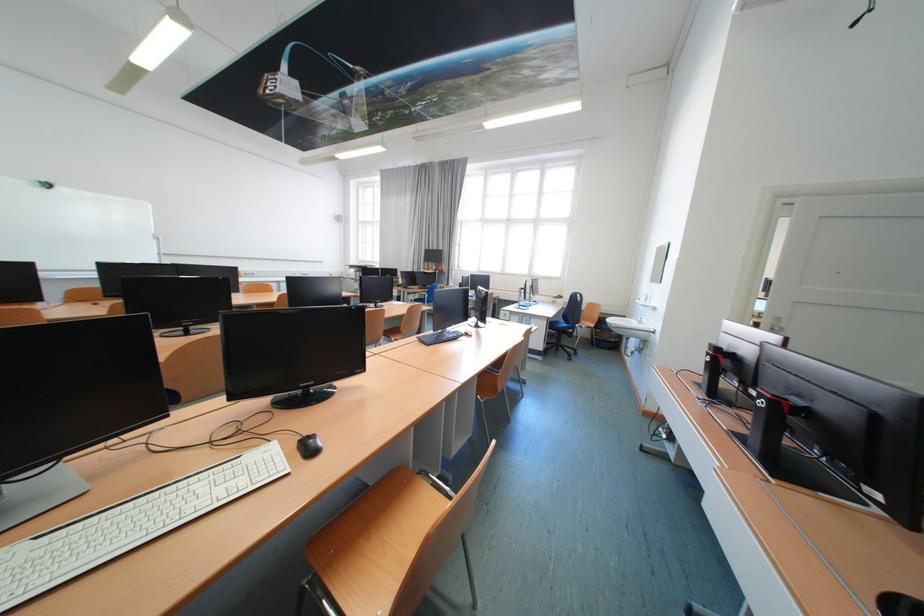
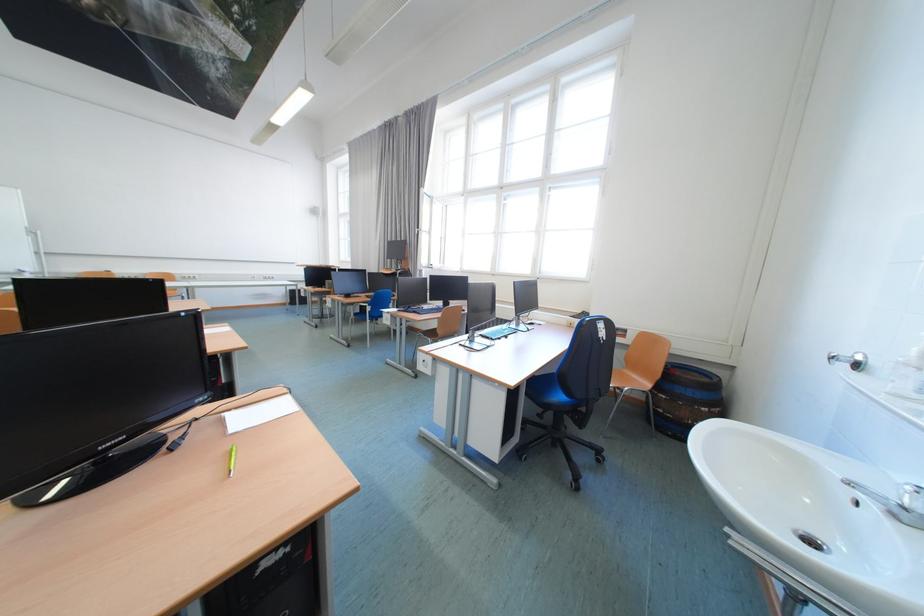
What movement of the cameraman would produce the second image?

The cameraman moved toward right, forward.